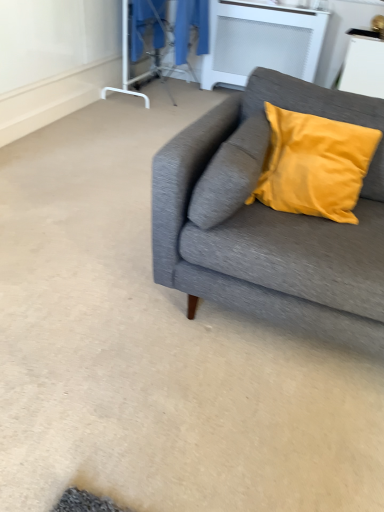
What are the coordinates of `free spot above white matte radiator at upper center, which is counted as the 1th table, starting from the left (from a real-world perspective)` in the screenshot? It's located at (265, 4).